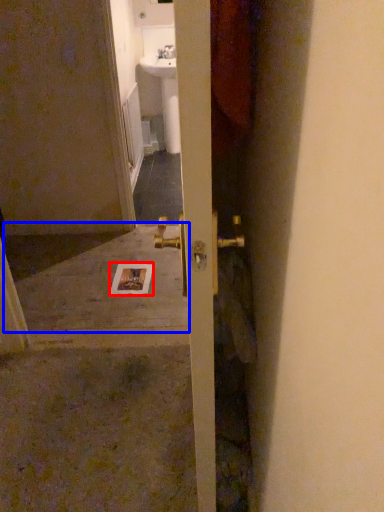
Question: Which point is further to the camera, postcard (highlighted by a red box) or concrete (highlighted by a blue box)?

Choices:
 (A) postcard
 (B) concrete

Answer: (A)